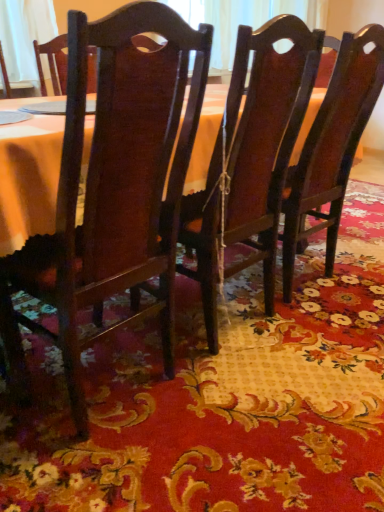
The image size is (384, 512). Identify the location of vacant region to the right of dark wood chair at center, which is counted as the 2th chair, starting from the left. (334, 333).